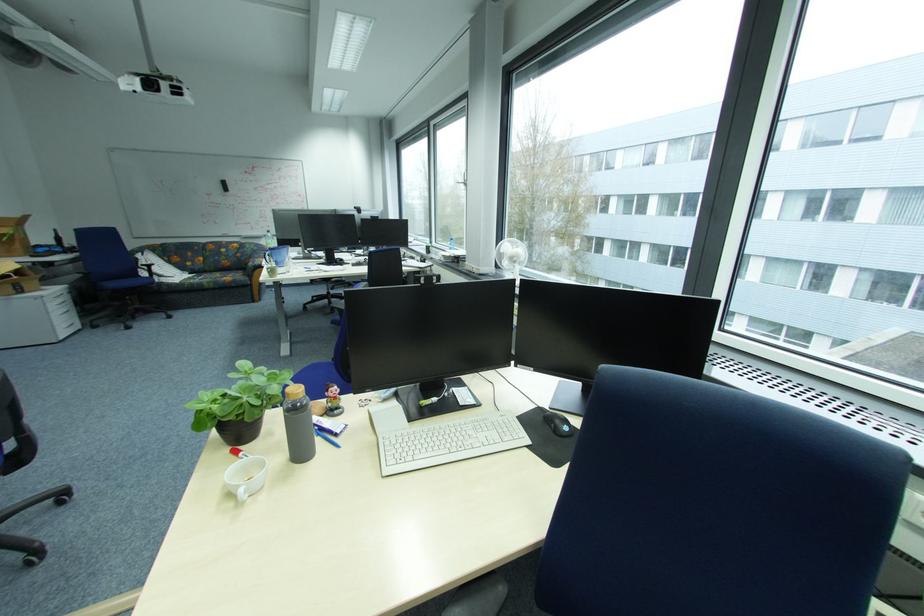
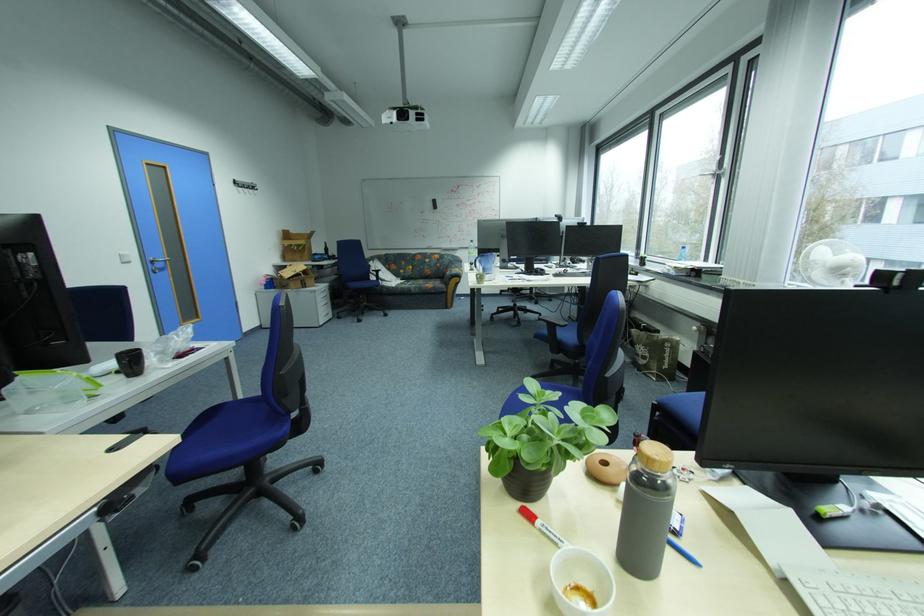
Find the pixel in the second image that matches point 264,249 in the first image.

(460, 261)